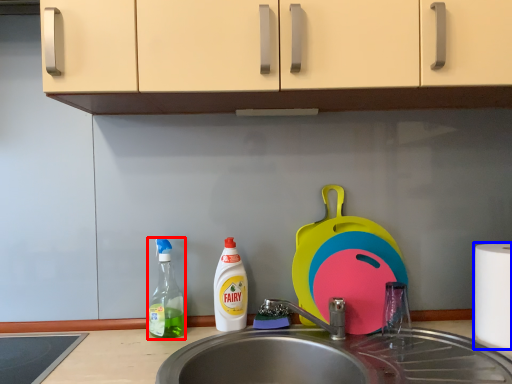
Question: Which point is further to the camera, bottle (highlighted by a red box) or paper towel (highlighted by a blue box)?

Choices:
 (A) bottle
 (B) paper towel

Answer: (A)